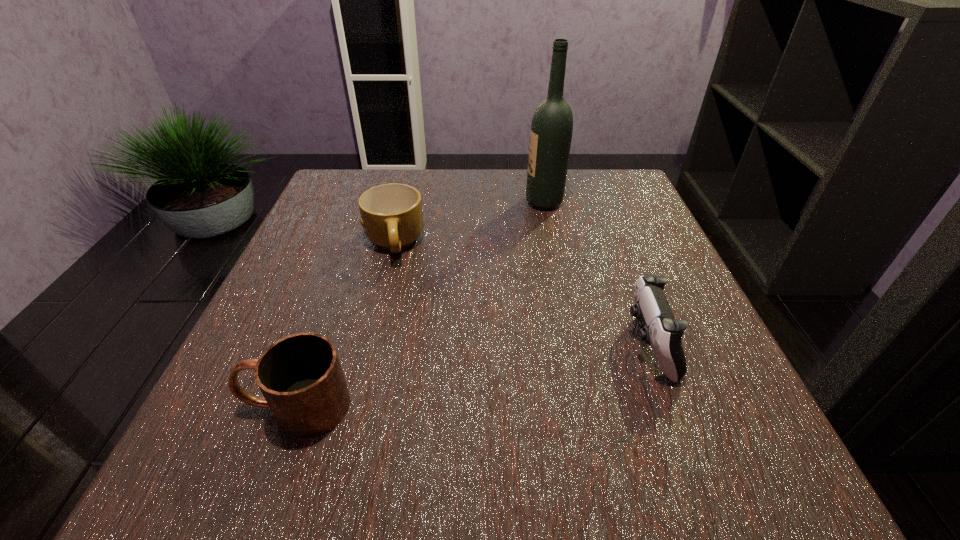
The image size is (960, 540). What are the coordinates of `free space located on the front-facing side of the rightmost object` in the screenshot? It's located at (494, 345).

Image resolution: width=960 pixels, height=540 pixels. Identify the location of vacant space located 0.200m on the side with the handle of the farther mug. (369, 347).

Locate an element on the screen. The width and height of the screenshot is (960, 540). object present at the far edge is located at coordinates (551, 131).

In order to click on object positioned at the near edge in this screenshot , I will do `click(300, 376)`.

This screenshot has width=960, height=540. What are the coordinates of `object positioned at the right edge` in the screenshot? It's located at (661, 330).

Find the location of a particular element. object that is at the near left corner is located at coordinates (300, 376).

The image size is (960, 540). Find the location of `blank space at the far edge`. blank space at the far edge is located at coordinates (457, 178).

Where is `vacant space at the near edge of the desktop`? The image size is (960, 540). vacant space at the near edge of the desktop is located at coordinates (372, 432).

In the image, there is a desktop. At what (x,y) coordinates should I click in order to perform the action: click on vacant space at the left edge. Please return your answer as a coordinate pair (x, y). The image size is (960, 540). Looking at the image, I should click on click(x=299, y=277).

The image size is (960, 540). I want to click on vacant space at the right edge of the desktop, so click(638, 321).